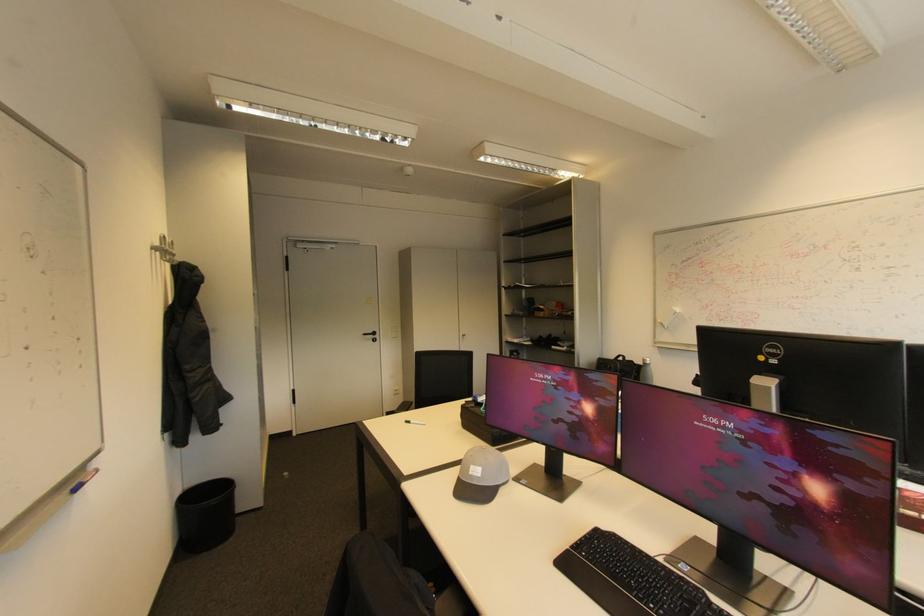
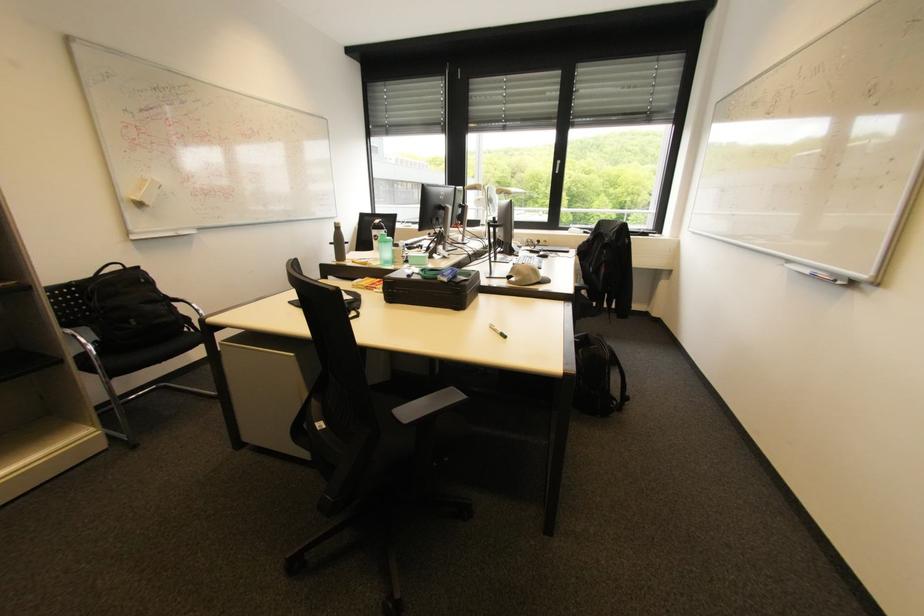
Where in the second image is the point corresponding to point (614, 367) from the first image?

(148, 281)